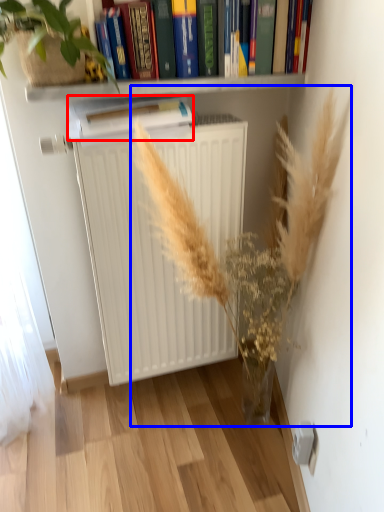
Question: Among these objects, which one is farthest to the camera, paperback book (highlighted by a red box) or floral arrangement (highlighted by a blue box)?

Choices:
 (A) paperback book
 (B) floral arrangement

Answer: (A)